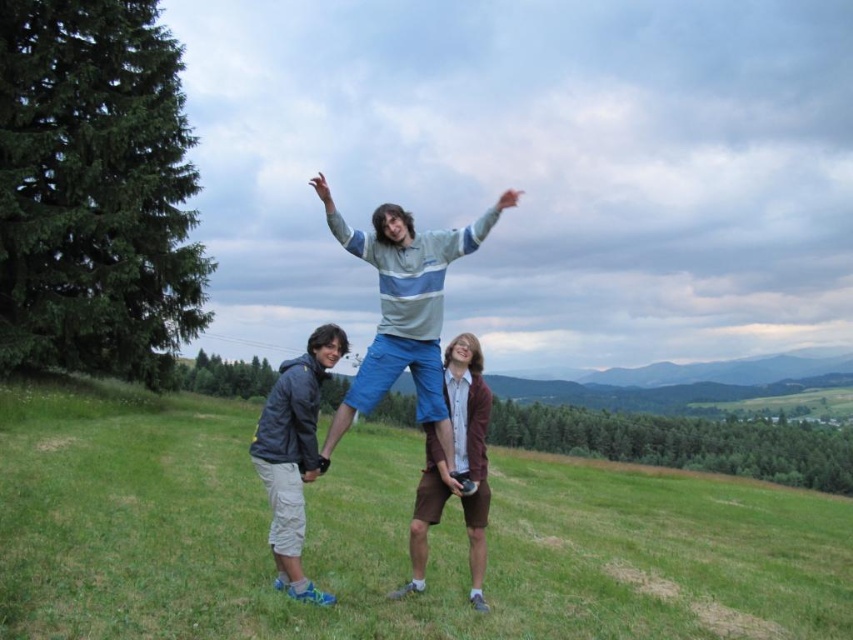
You are a photographer trying to capture the striped cotton shirt at center and the gray fabric jacket at lower left in the same frame. Based on their positions, which one is higher up in the image?

The striped cotton shirt at center is located above the gray fabric jacket at lower left, so it is higher up in the image.

You are planning to set up a small tent in the green grassy field at center. Considering the space occupied by the gray fabric jacket at lower left, will there be enough room for the tent?

The green grassy field at center is wider than the gray fabric jacket at lower left, so there should be enough room to set up the tent in the green grassy field at center.

You are planning to take a photo of the striped cotton shirt at center and the green grassy field at center. Which object occupies more horizontal space in the image?

The green grassy field at center occupies more horizontal space than the striped cotton shirt at center because its width is larger.